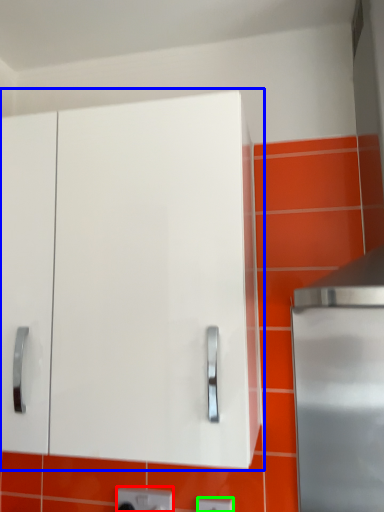
Question: Based on their relative distances, which object is farther from electric outlet (highlighted by a red box)? Choose from cabinetry (highlighted by a blue box) and electric outlet (highlighted by a green box).

Choices:
 (A) cabinetry
 (B) electric outlet

Answer: (A)